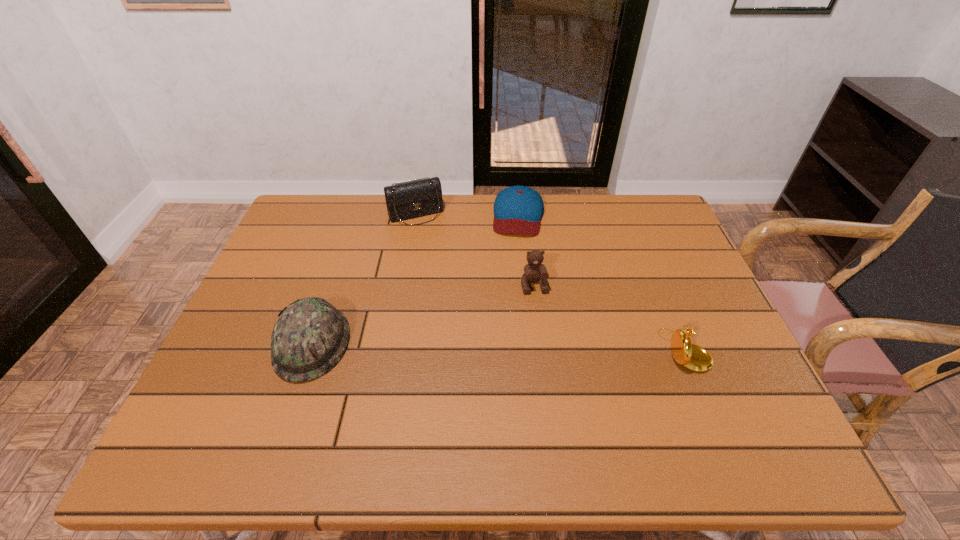
Where is `headwear`? headwear is located at coordinates (310, 336).

Find the location of a particular element. the rightmost object is located at coordinates (693, 357).

Identify the location of the third farthest object. (534, 271).

Locate an element on the screen. baseball cap is located at coordinates (517, 209).

This screenshot has width=960, height=540. In order to click on clutch bag in this screenshot , I will do `click(412, 199)`.

Find the location of a particular element. vacant space located 0.190m on the back of the leftmost object is located at coordinates (340, 261).

At what (x,y) coordinates should I click in order to perform the action: click on free region located on the face of the third nearest object. Please return your answer as a coordinate pair (x, y). The image size is (960, 540). Looking at the image, I should click on (544, 336).

Image resolution: width=960 pixels, height=540 pixels. Find the location of `vacant region located on the face of the third nearest object`. vacant region located on the face of the third nearest object is located at coordinates (540, 315).

I want to click on free region located on the face of the third nearest object, so click(552, 370).

What are the coordinates of `blank space located 0.400m with the bill of the baseball cap facing forward` in the screenshot? It's located at (506, 340).